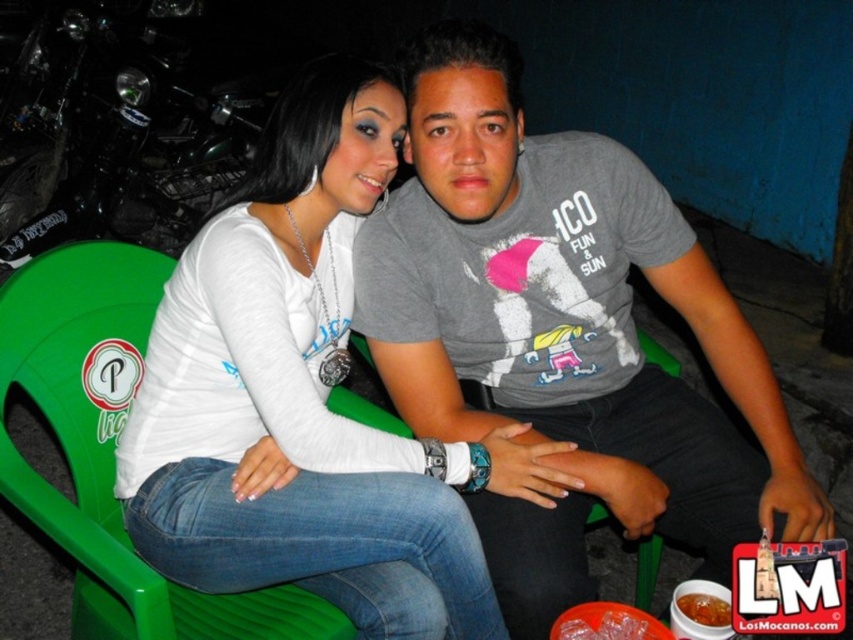
Question: Which object is the farthest from the green plastic chair at center?

Choices:
 (A) gray cotton t-shirt at center
 (B) green plastic chair at left
 (C) white matte shirt at center

Answer: (B)

Question: Which point is closer to the camera?

Choices:
 (A) green plastic chair at center
 (B) green plastic chair at left
 (C) white matte shirt at center
 (D) gray cotton t-shirt at center

Answer: (B)

Question: Estimate the real-world distances between objects in this image. Which object is closer to the green plastic chair at center?

Choices:
 (A) gray cotton t-shirt at center
 (B) white matte shirt at center
 (C) green plastic chair at left

Answer: (A)

Question: Is green plastic chair at left positioned behind green plastic chair at center?

Choices:
 (A) yes
 (B) no

Answer: (B)

Question: Is white matte shirt at center below green plastic chair at center?

Choices:
 (A) no
 (B) yes

Answer: (A)

Question: Is green plastic chair at left below green plastic chair at center?

Choices:
 (A) yes
 (B) no

Answer: (B)